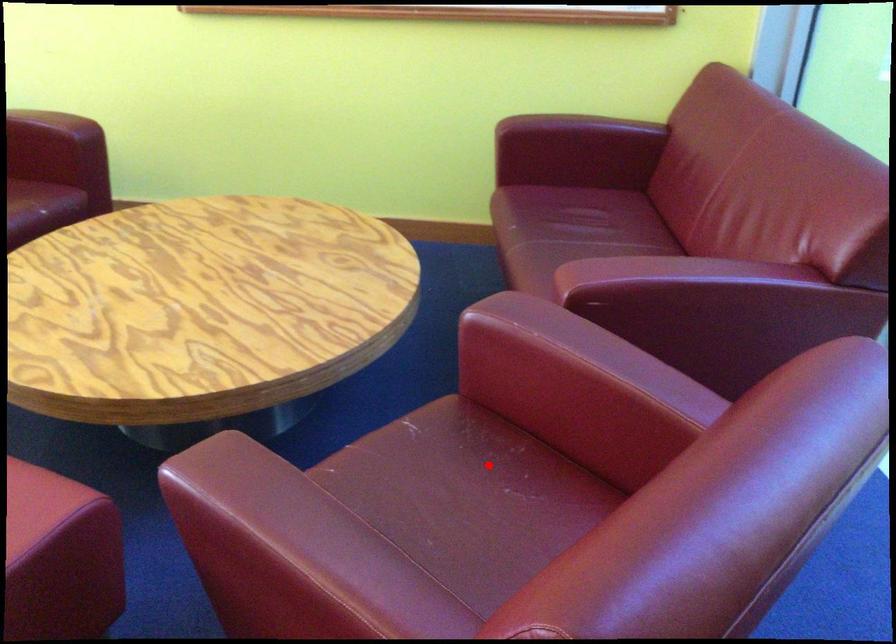
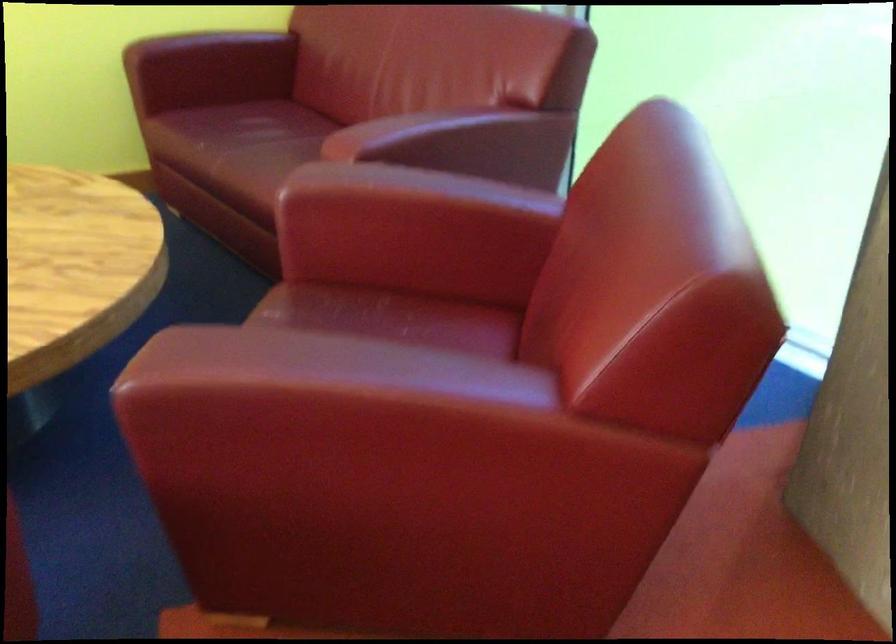
The point at the highlighted location is marked in the first image. Where is the corresponding point in the second image?

(382, 315)